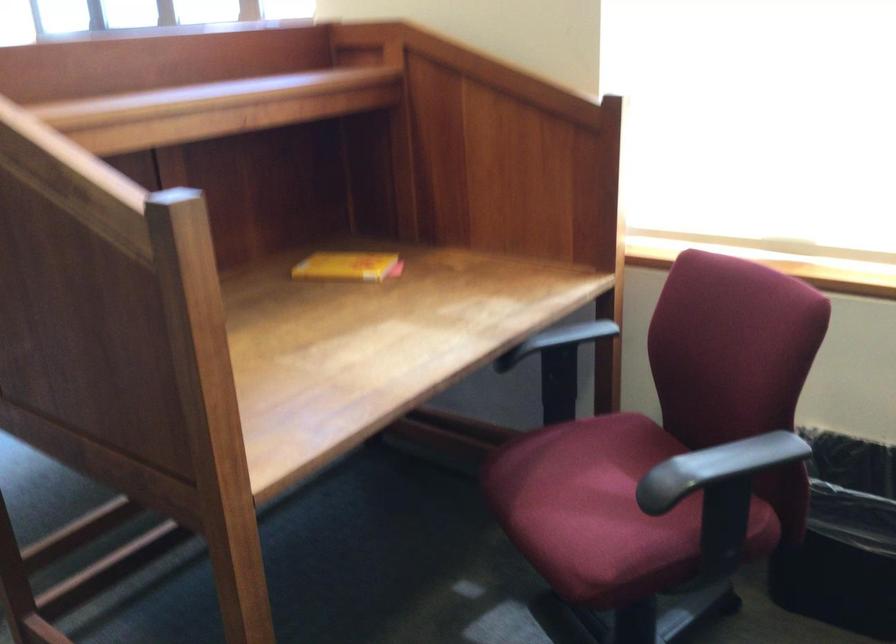
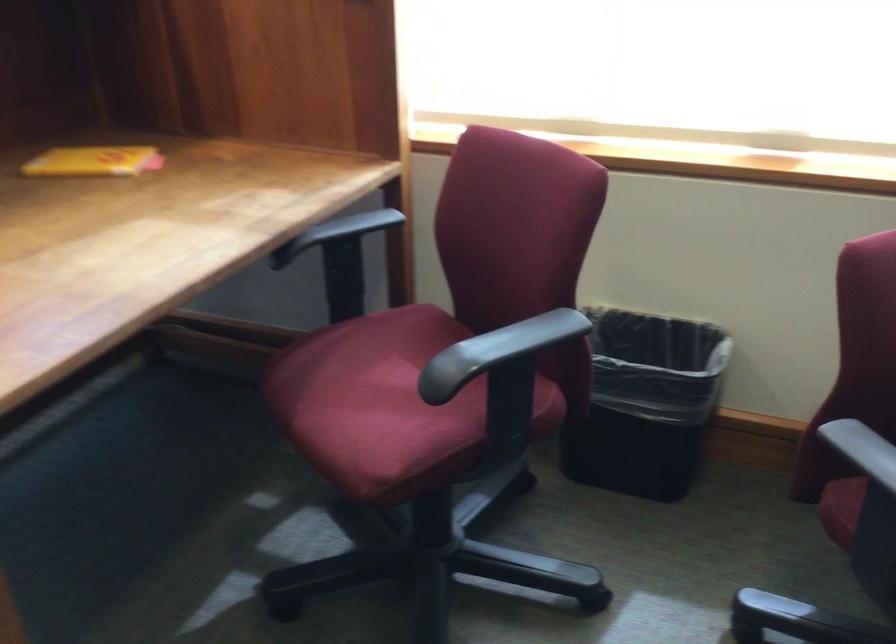
In a continuous first-person perspective shot, in which direction is the camera moving?

The cameraman moved toward right, forward.